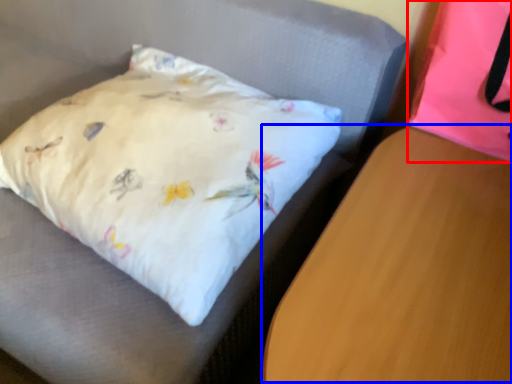
Question: Which of the following is the farthest to the observer, pillow (highlighted by a red box) or table (highlighted by a blue box)?

Choices:
 (A) pillow
 (B) table

Answer: (A)